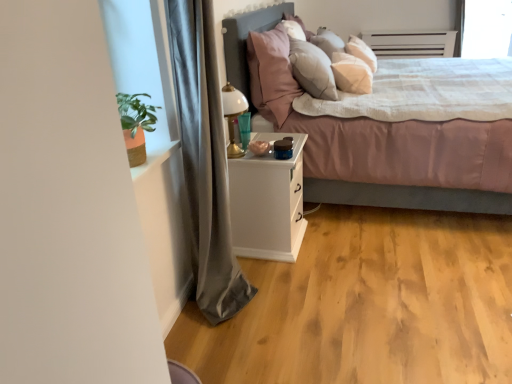
Identify the location of vacant space that's between gray fabric curtain at left and white matte nightstand at center. (265, 276).